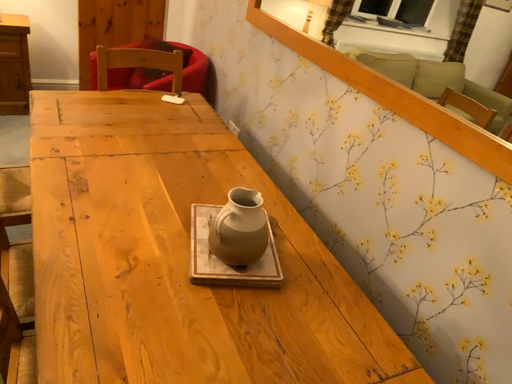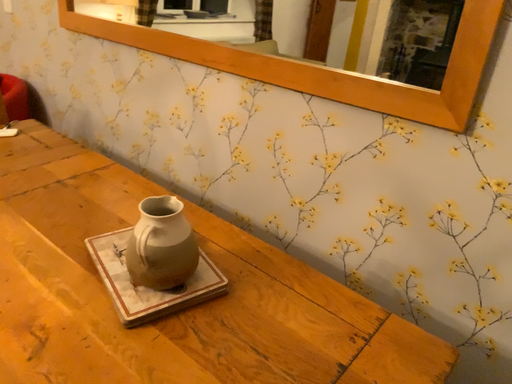
Question: How did the camera likely rotate when shooting the video?

Choices:
 (A) rotated right
 (B) rotated left

Answer: (A)